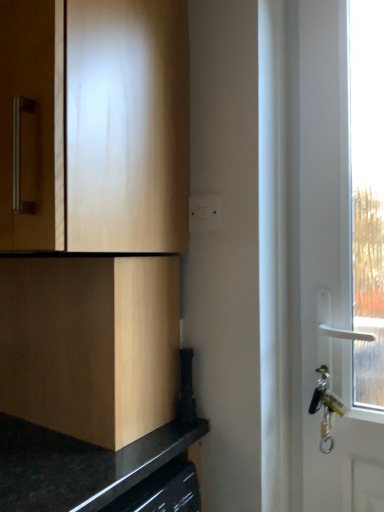
Question: Looking at their shapes, would you say light wood cabinet at upper left, marked as the 1th cabinetry in a top-to-bottom arrangement, is wider or thinner than white plastic switch at center?

Choices:
 (A) wide
 (B) thin

Answer: (A)

Question: Is light wood cabinet at upper left, marked as the 1th cabinetry in a top-to-bottom arrangement, in front of or behind white plastic switch at center in the image?

Choices:
 (A) behind
 (B) front

Answer: (B)

Question: Which of these objects is positioned closest to the light wood cabinet at upper left, the second cabinetry in the bottom-to-top sequence?

Choices:
 (A) matte wood cabinet at lower left, acting as the 2th cabinetry starting from the top
 (B) white plastic switch at center

Answer: (A)

Question: Which object is positioned closest to the light wood cabinet at upper left, the second cabinetry in the bottom-to-top sequence?

Choices:
 (A) white plastic switch at center
 (B) matte wood cabinet at lower left, acting as the 2th cabinetry starting from the top

Answer: (B)